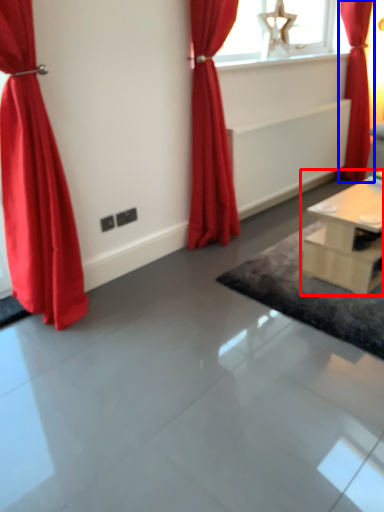
Question: Which object appears farthest to the camera in this image, table (highlighted by a red box) or curtain (highlighted by a blue box)?

Choices:
 (A) table
 (B) curtain

Answer: (B)